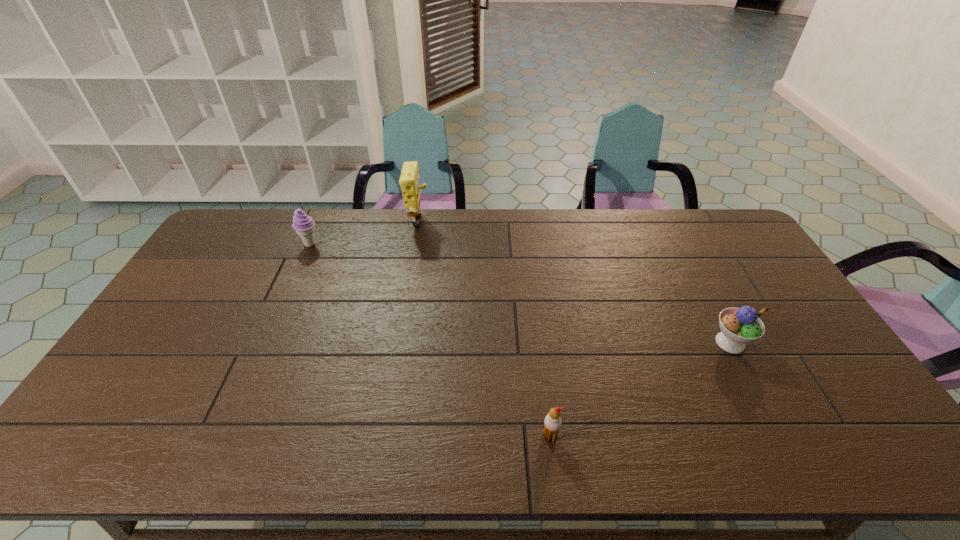
This screenshot has height=540, width=960. In order to click on free region located on the back of the rightmost object in this screenshot , I will do `click(684, 253)`.

What are the coordinates of `sponge at the far edge` in the screenshot? It's located at (409, 181).

The image size is (960, 540). What are the coordinates of `icecream at the far edge` in the screenshot? It's located at (303, 224).

Identify the location of object that is at the near edge. The width and height of the screenshot is (960, 540). (552, 423).

Locate an element on the screen. The image size is (960, 540). vacant space at the far edge is located at coordinates (643, 249).

The image size is (960, 540). In order to click on vacant area at the near edge in this screenshot , I will do `click(799, 441)`.

The image size is (960, 540). Identify the location of vacant point at the left edge. tap(182, 325).

What are the coordinates of `free spot at the right edge of the desktop` in the screenshot? It's located at (732, 280).

Identify the location of free location at the near right corner of the desktop. The height and width of the screenshot is (540, 960). [819, 437].

Where is `vacant space in between the leftmost object and the third object from left to right`? The height and width of the screenshot is (540, 960). vacant space in between the leftmost object and the third object from left to right is located at coordinates (430, 340).